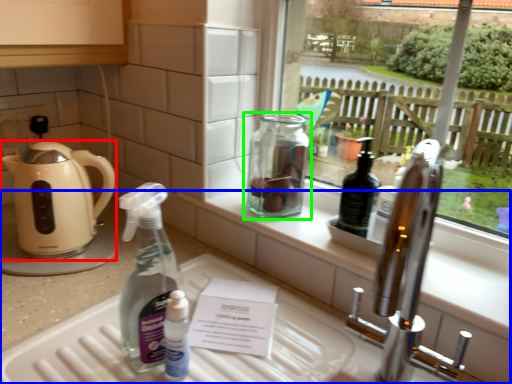
Question: Considering the real-world distances, which object is closest to kettle (highlighted by a red box)? counter (highlighted by a blue box) or bottle (highlighted by a green box).

Choices:
 (A) counter
 (B) bottle

Answer: (A)